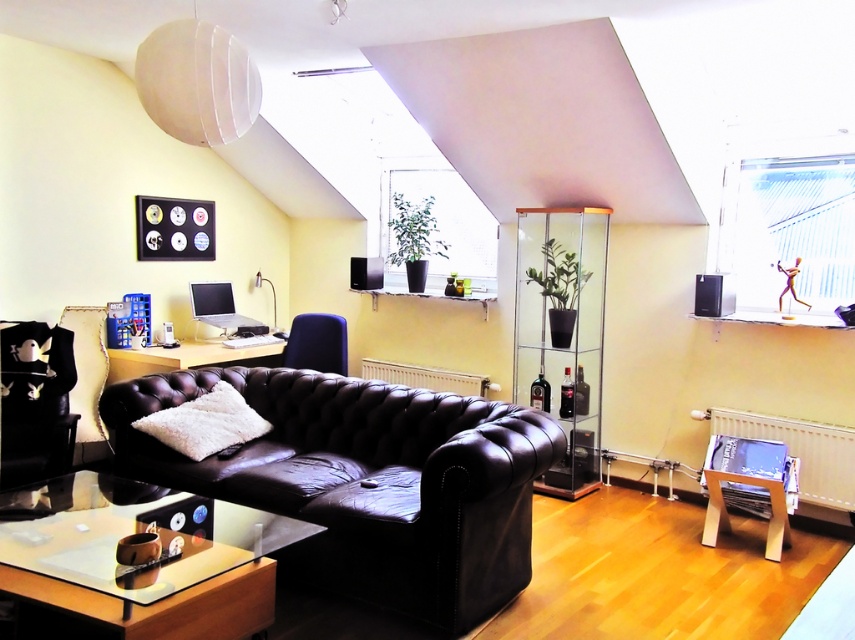
You are standing in the living space and want to place a large potted plant between the black leather Chesterfield sofa and the black leather armchair at left. Based on their positions, will the plant fit comfortably in the space between them?

The black leather armchair at left is located at point (34, 403), so the distance between the sofa and the chair needs to be assessed to determine if the plant will fit. However, without specific measurements of the sofa and chair dimensions or the exact distance between them, it is unclear if the plant will fit comfortably.

You are sitting on the black leather armchair at left and want to reach the black matte speaker at upper right to turn it off. Can you directly touch the speaker without getting up?

The black leather armchair at left is located below the black matte speaker at upper right, so you cannot directly touch the speaker without getting up since it is above you.

You are standing in the living space and want to pick up an object. You notice two points marked in the scene. Which point, point (52, 372) or point (732, 291), is closer to you?

Point (52, 372) is closer to you than point (732, 291).